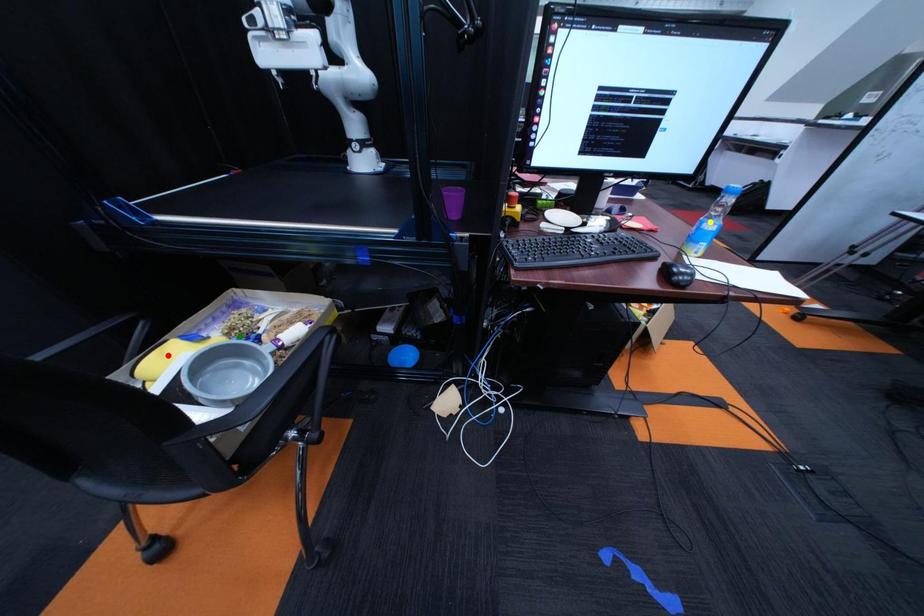
Order these from nearest to farthest:
A) green point
B) yellow point
C) red point

green point < yellow point < red point